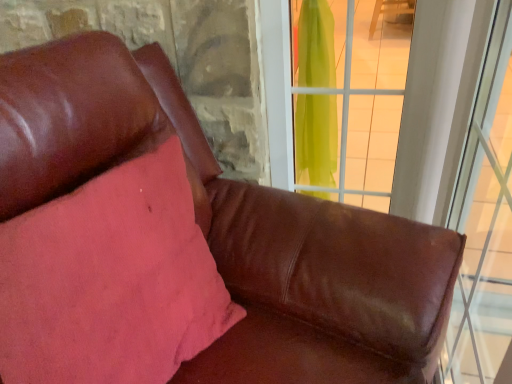
Question: Is pink fabric pillow at upper left in front of or behind transparent glass window at right, the 1th window positioned from the right, in the image?

Choices:
 (A) behind
 (B) front

Answer: (A)

Question: In the image, is pink fabric pillow at upper left on the left side or the right side of transparent glass window at right, which ranks as the second window in left-to-right order?

Choices:
 (A) left
 (B) right

Answer: (A)

Question: Estimate the real-world distances between objects in this image. Which object is farther from the transparent glass window at right, which ranks as the second window in left-to-right order?

Choices:
 (A) pink fabric pillow at upper left
 (B) transparent green curtain at upper right, marked as the 2th window in a right-to-left arrangement

Answer: (A)

Question: Considering the real-world distances, which object is closest to the transparent green curtain at upper right, marked as the 2th window in a right-to-left arrangement?

Choices:
 (A) pink fabric pillow at upper left
 (B) transparent glass window at right, which ranks as the second window in left-to-right order

Answer: (B)